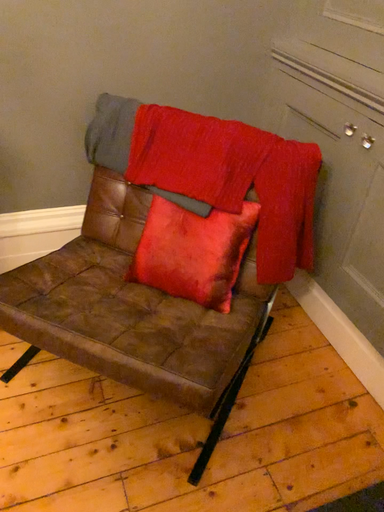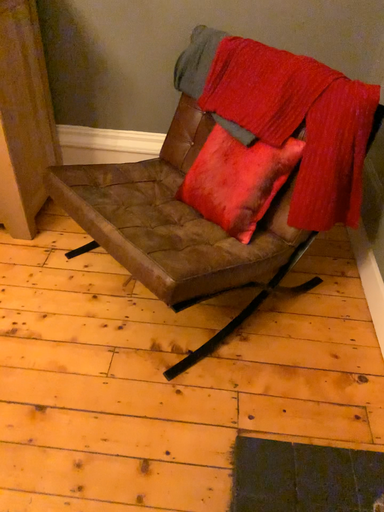
Question: How did the camera likely rotate when shooting the video?

Choices:
 (A) rotated left
 (B) rotated right

Answer: (A)